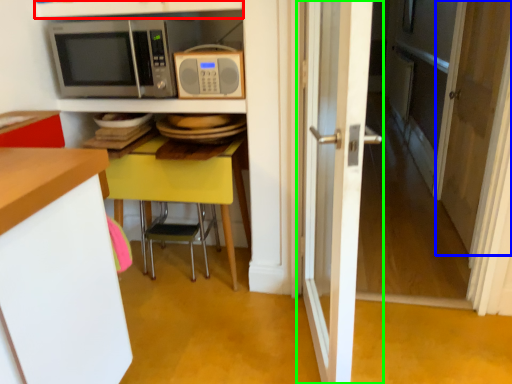
Question: Which object is the closest to the shelf (highlighted by a red box)? Choose among these: screen door (highlighted by a blue box) or door (highlighted by a green box).

Choices:
 (A) screen door
 (B) door

Answer: (B)